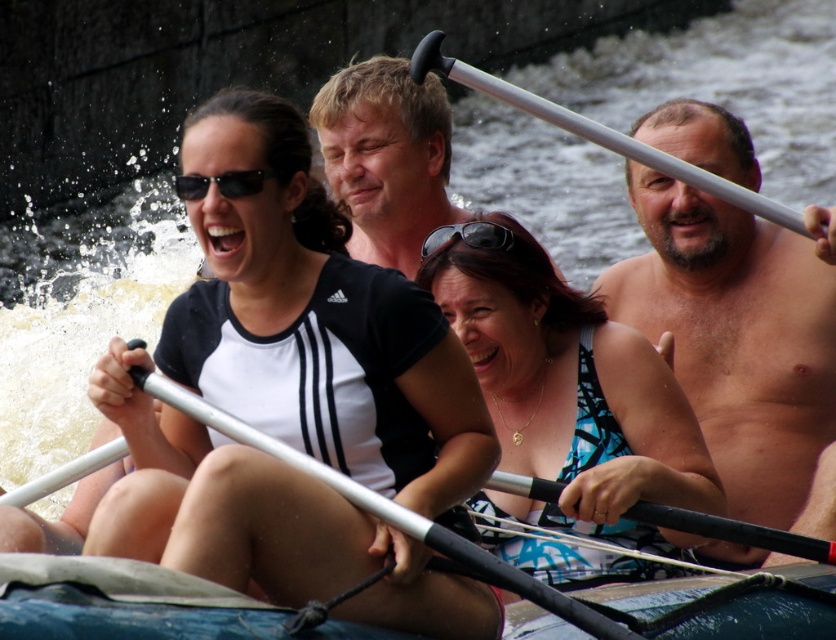
Question: Which point appears closest to the camera in this image?

Choices:
 (A) (732, 218)
 (B) (223, 180)

Answer: (B)

Question: Among these objects, which one is farthest from the camera?

Choices:
 (A) black matte sunglasses at upper left
 (B) silver metallic paddle at upper right

Answer: (A)

Question: Is blue printed swimsuit at center to the left of black plastic sunglasses at center from the viewer's perspective?

Choices:
 (A) no
 (B) yes

Answer: (A)

Question: Which point is closer to the camera?

Choices:
 (A) (533, 588)
 (B) (653, 160)
 (C) (809, 332)
 (D) (207, 177)

Answer: (A)

Question: Where is blue printed swimsuit at center located in relation to silver metallic paddle at upper right in the image?

Choices:
 (A) right
 (B) left

Answer: (A)

Question: Does blue printed swimsuit at center have a larger size compared to black plastic sunglasses at center?

Choices:
 (A) no
 (B) yes

Answer: (B)